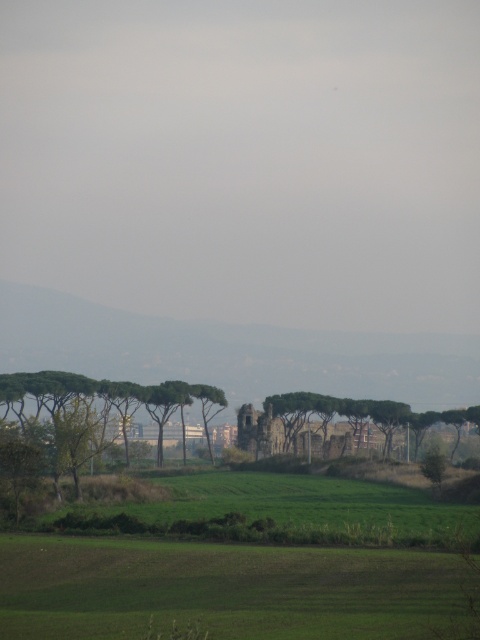
Question: Does green leafy tree at left appear on the right side of green leafy tree at center?

Choices:
 (A) no
 (B) yes

Answer: (A)

Question: Which point appears closest to the camera in this image?

Choices:
 (A) (73, 406)
 (B) (479, 416)

Answer: (A)

Question: Considering the relative positions of green leafy tree at left and green leafy tree at center in the image provided, where is green leafy tree at left located with respect to green leafy tree at center?

Choices:
 (A) left
 (B) right

Answer: (A)

Question: Can you confirm if green leafy tree at left is wider than green leafy tree at center?

Choices:
 (A) no
 (B) yes

Answer: (A)

Question: Among these points, which one is nearest to the camera?

Choices:
 (A) (39, 433)
 (B) (351, 408)

Answer: (A)